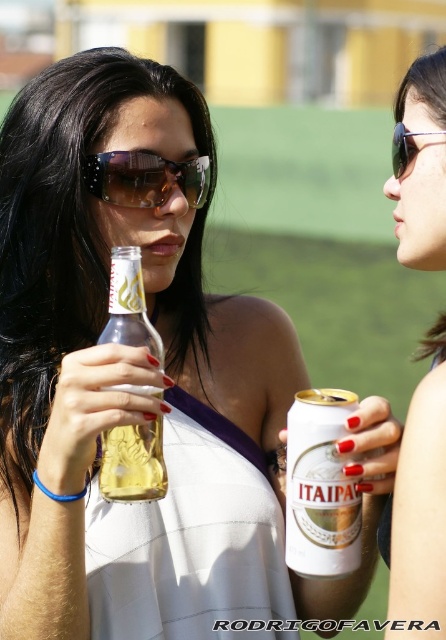
You are at a party and want to choose a pair of sunglasses that is bigger between the matte black sunglasses at upper right and the brown reflective sunglasses at center. Which one should you pick?

The matte black sunglasses at upper right has a larger size compared to brown reflective sunglasses at center, so you should pick the matte black sunglasses at upper right.

You are a photographer trying to capture a group photo of the two people in the scene. The minimum focusing distance for your camera is 24 inches. Will both pairs of sunglasses, the matte black sunglasses at upper right and the brown reflective sunglasses at center, be in focus?

The matte black sunglasses at upper right is 23.61 inches away from the brown reflective sunglasses at center. Since the distance between them is less than the camera minimum focusing distance of 24 inches, the camera may not be able to focus on both pairs simultaneously, resulting in one being blurry.

You are at an outdoor event and see two points marked in the image. The first point is at coordinates point (x=392, y=616) and the second is at point (x=301, y=499). Which point is closer to you?

Point (x=392, y=616) is in front of point (x=301, y=499), so the first point is closer to you.